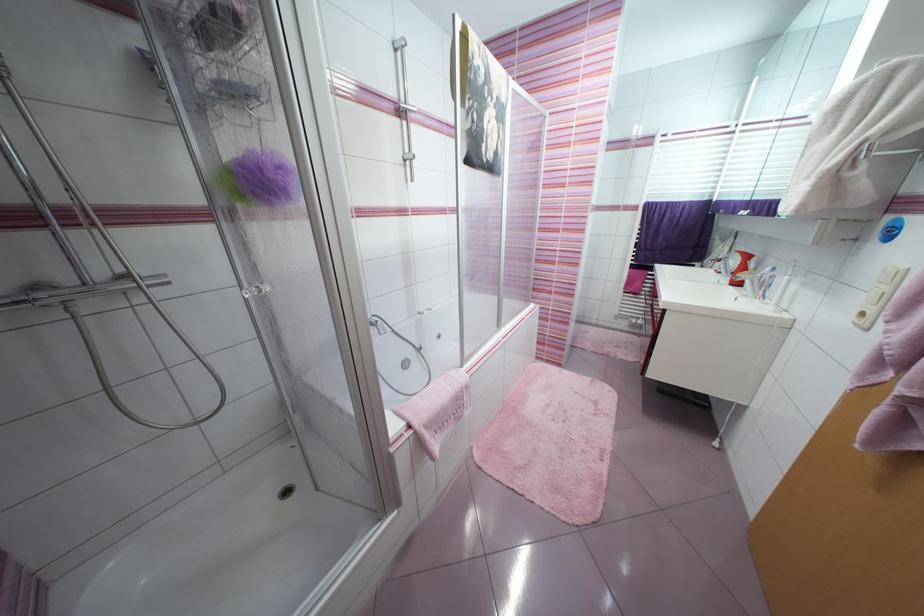
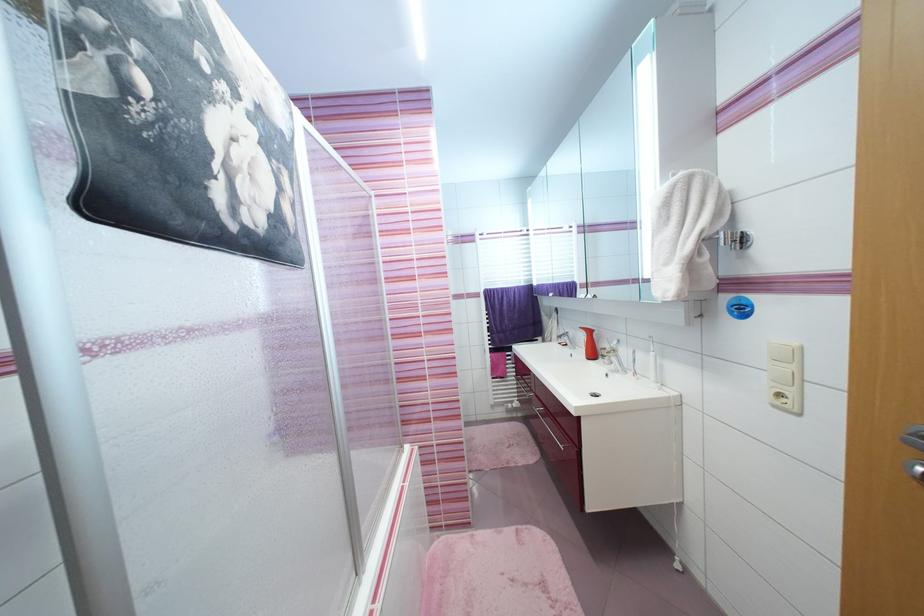
Question: The camera is either moving clockwise (left) or counter-clockwise (right) around the object. The first image is from the beginning of the video and the second image is from the end. Is the camera moving left or right when shooting the video?

Choices:
 (A) Left
 (B) Right

Answer: (A)